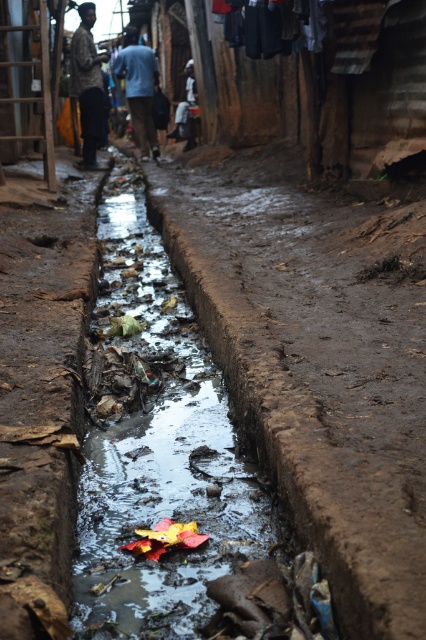
Looking at this image, you are a delivery person carrying a heavy box and need to walk through the alley. The muddy stream at center is in your path. Can you safely step over it to avoid getting your shoes wet? Explain your reasoning based on the distance between the stream and the patterned fabric shirt at upper left.

The muddy stream at center is closer to the viewer than the patterned fabric shirt at upper left. Since the stream is closer, it is physically lower in the alleyway, making it easier to step over without getting wet. The patterned fabric shirt at upper left is farther away, indicating the stream is near the front, so stepping over it should be manageable.

You are a delivery person trying to navigate through the narrow alley. You need to avoid stepping into the muddy stream at center. Which direction should you move relative to the blue cotton shirt at upper center to stay clear of the stream?

The muddy stream at center is to the right of the blue cotton shirt at upper center, so you should move to the left side of the blue cotton shirt at upper center to avoid stepping into the stream.

You are standing at point (193, 516) in the alley. You need to walk to the other side of the drainage channel. The channel is filled with murky water and debris. Can you safely cross the channel without getting your shoes wet?

The individuals standing near the edge of the drainage channel are 2.85 meters apart, so you can cross the channel safely by stepping on the dry ground between them. However, the channel itself is filled with water and debris, so avoid stepping into it to keep your shoes dry.